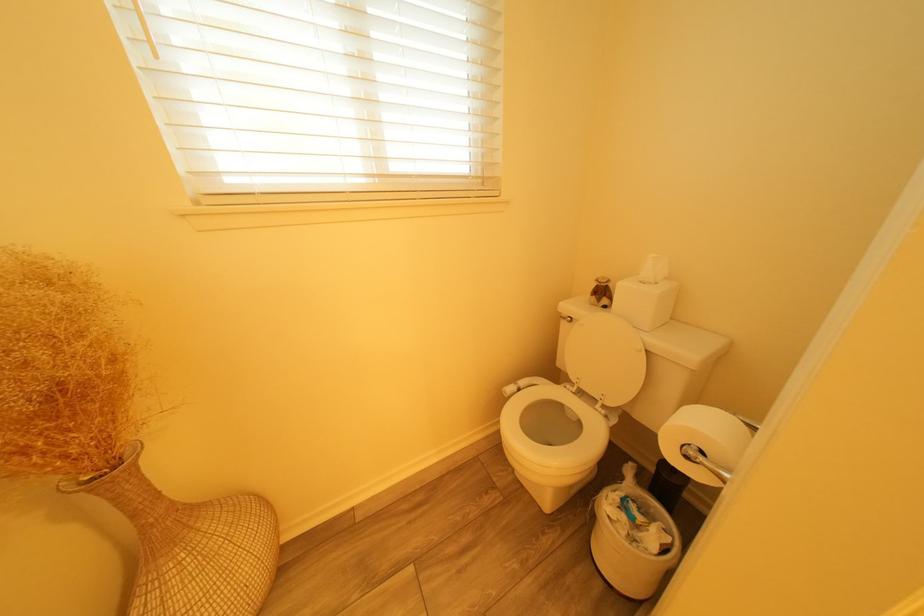
Describe the element at coordinates (703, 443) in the screenshot. This screenshot has height=616, width=924. I see `the toilet paper roll` at that location.